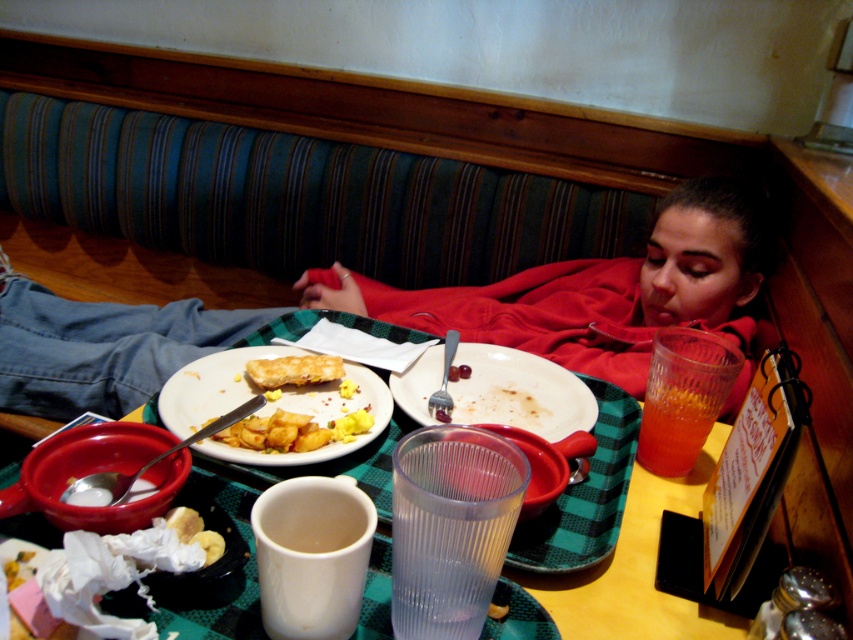
Consider the image. Is white matte plate at center thinner than golden brown pastry at lower left?

Incorrect, white matte plate at center's width is not less than golden brown pastry at lower left's.

Which is above, white matte plate at center or golden brown pastry at lower left?

white matte plate at center is above.

Does point (566, 369) come farther from viewer compared to point (216, 538)?

Yes, it is behind point (216, 538).

Find the location of a particular element. This screenshot has height=640, width=853. white matte plate at center is located at coordinates (519, 392).

Can you confirm if translucent glass water at center is thinner than clear glass cup at center?

In fact, translucent glass water at center might be wider than clear glass cup at center.

Can you confirm if translucent glass water at center is positioned above clear glass cup at center?

Yes.

Does point (608, 586) come in front of point (408, 556)?

No, it is behind (408, 556).

Locate an element on the screen. translucent glass water at center is located at coordinates (624, 541).

Who is shorter, red hoodie at upper center or white ceramic mug at lower center?

white ceramic mug at lower center is shorter.

Which is behind, point (158, 380) or point (360, 592)?

Point (158, 380)

This screenshot has height=640, width=853. I want to click on red hoodie at upper center, so click(599, 289).